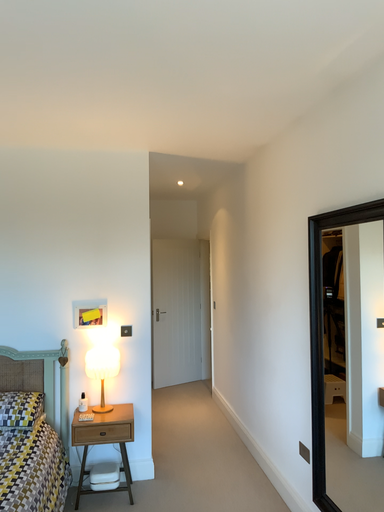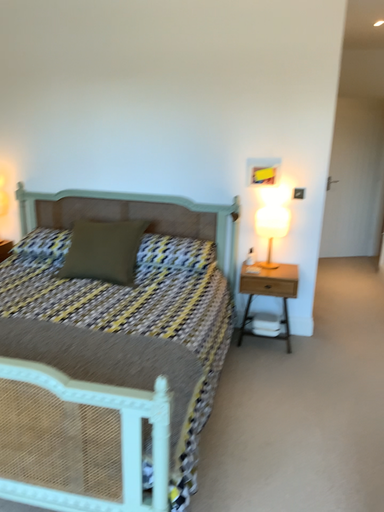
Question: How did the camera likely rotate when shooting the video?

Choices:
 (A) rotated left
 (B) rotated right

Answer: (A)